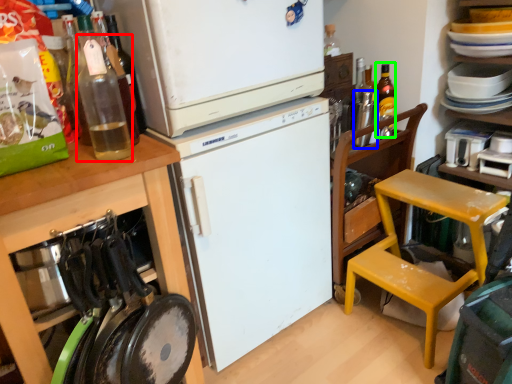
Question: Considering the real-world distances, which object is farthest from bottle (highlighted by a red box)? bottle (highlighted by a blue box) or bottle (highlighted by a green box)?

Choices:
 (A) bottle
 (B) bottle

Answer: (B)